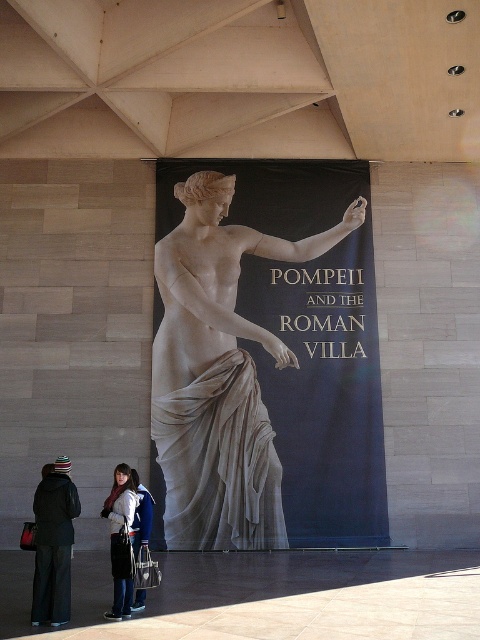
Question: Which of these objects is positioned closest to the black woolen jacket at lower left?

Choices:
 (A) white knit hat at lower left
 (B) white marble statue at center

Answer: (A)

Question: Can you confirm if white marble statue at center is positioned above black woolen jacket at lower left?

Choices:
 (A) no
 (B) yes

Answer: (A)

Question: Can you confirm if white marble statue at center is thinner than white knit hat at lower left?

Choices:
 (A) yes
 (B) no

Answer: (B)

Question: Which of these objects is positioned closest to the white marble statue at center?

Choices:
 (A) white knit hat at lower left
 (B) black woolen jacket at lower left

Answer: (A)

Question: Which of the following is the farthest from the observer?

Choices:
 (A) white marble statue at center
 (B) black woolen jacket at lower left
 (C) white knit hat at lower left

Answer: (A)

Question: Can you confirm if white marble statue at center is smaller than white knit hat at lower left?

Choices:
 (A) no
 (B) yes

Answer: (B)